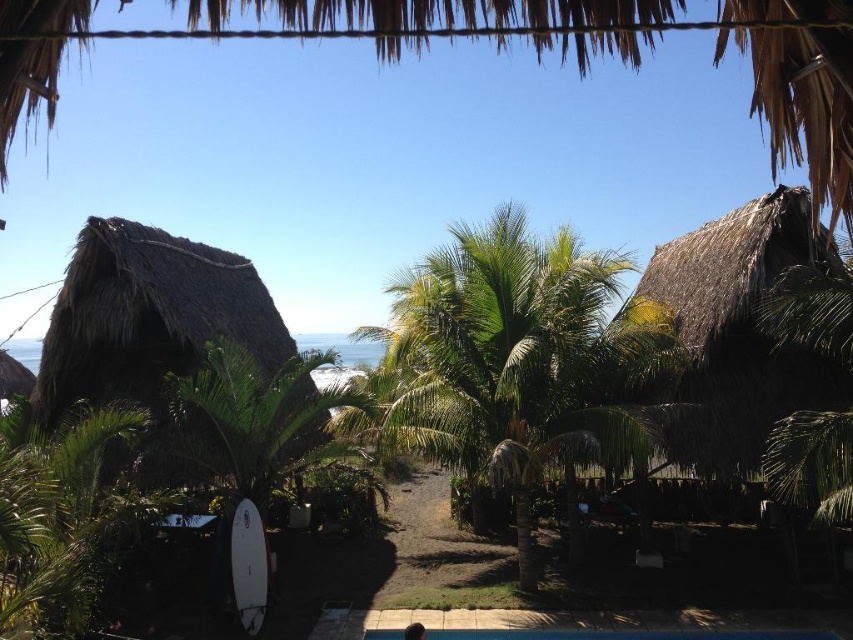
Is green leafy palm tree at center behind white matte surfboard at lower left?

Yes, it is behind white matte surfboard at lower left.

Does point (424, 422) come in front of point (252, 513)?

No, (424, 422) is further to viewer.

Identify the location of green leafy palm tree at center. (512, 362).

Which is below, thatched roof hut at right or dark brown hair at lower center?

dark brown hair at lower center is below.

Can you confirm if thatched roof hut at right is bigger than dark brown hair at lower center?

Yes, thatched roof hut at right is bigger than dark brown hair at lower center.

Is point (795, 392) behind point (403, 634)?

That is True.

Locate an element on the screen. The height and width of the screenshot is (640, 853). thatched roof hut at right is located at coordinates (738, 333).

Which is behind, point (682, 408) or point (256, 538)?

Positioned behind is point (682, 408).

The image size is (853, 640). What are the coordinates of `thatched roof hut at right` in the screenshot? It's located at (738, 333).